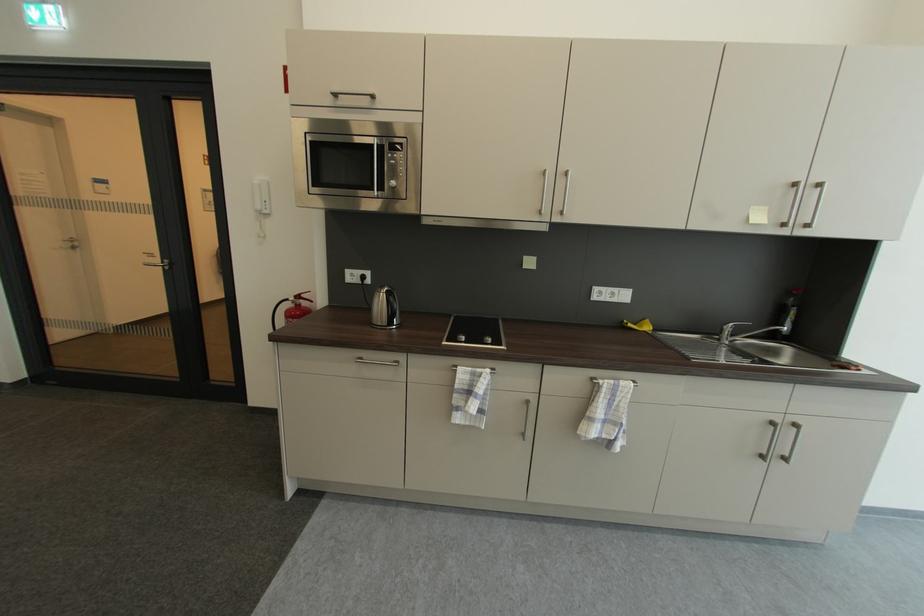
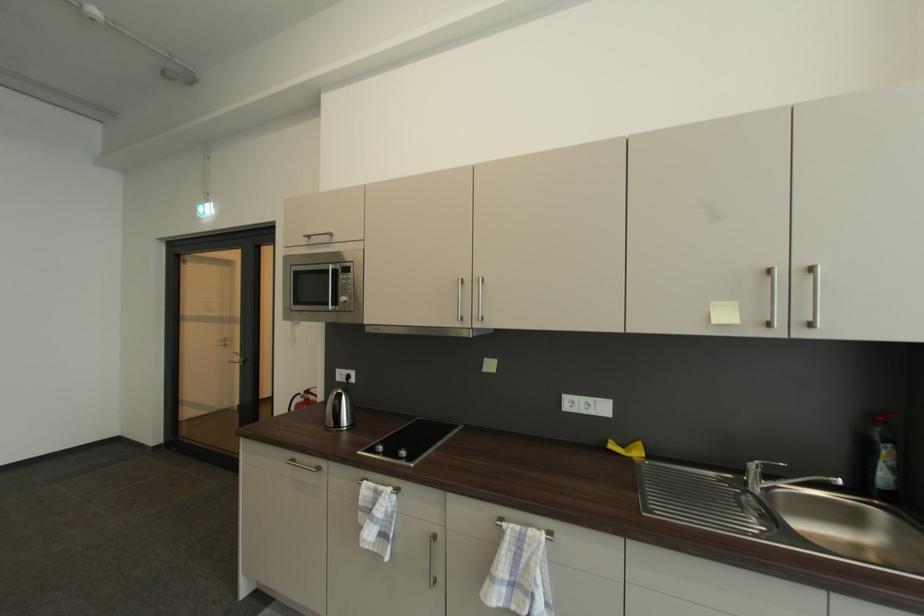
The point at (629, 323) is marked in the first image. Where is the corresponding point in the second image?

(613, 443)